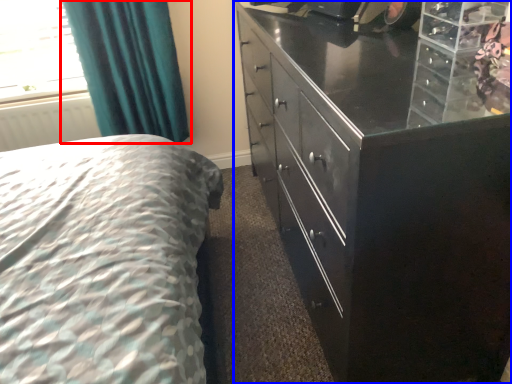
Question: Among these objects, which one is farthest to the camera, curtain (highlighted by a red box) or chest of drawers (highlighted by a blue box)?

Choices:
 (A) curtain
 (B) chest of drawers

Answer: (A)